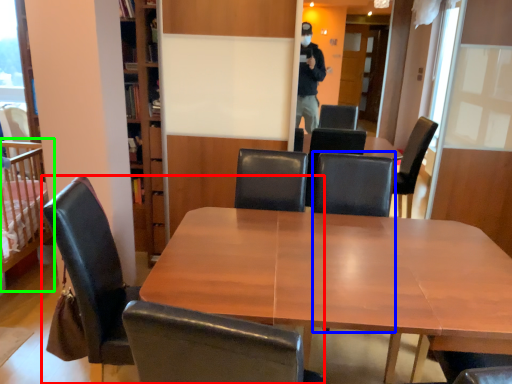
Question: Considering the real-world distances, which object is farthest from chair (highlighted by a red box)? armchair (highlighted by a blue box) or infant bed (highlighted by a green box)?

Choices:
 (A) armchair
 (B) infant bed

Answer: (A)